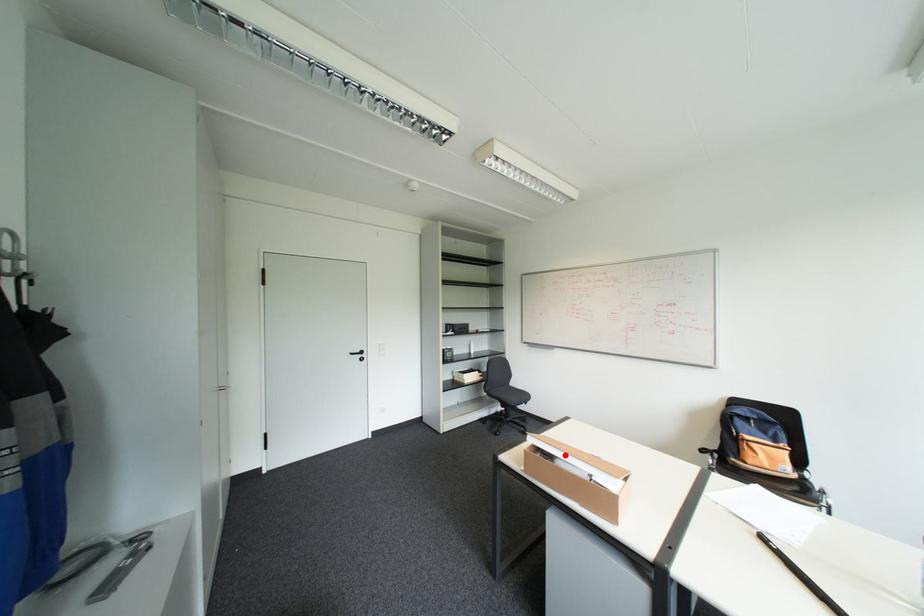
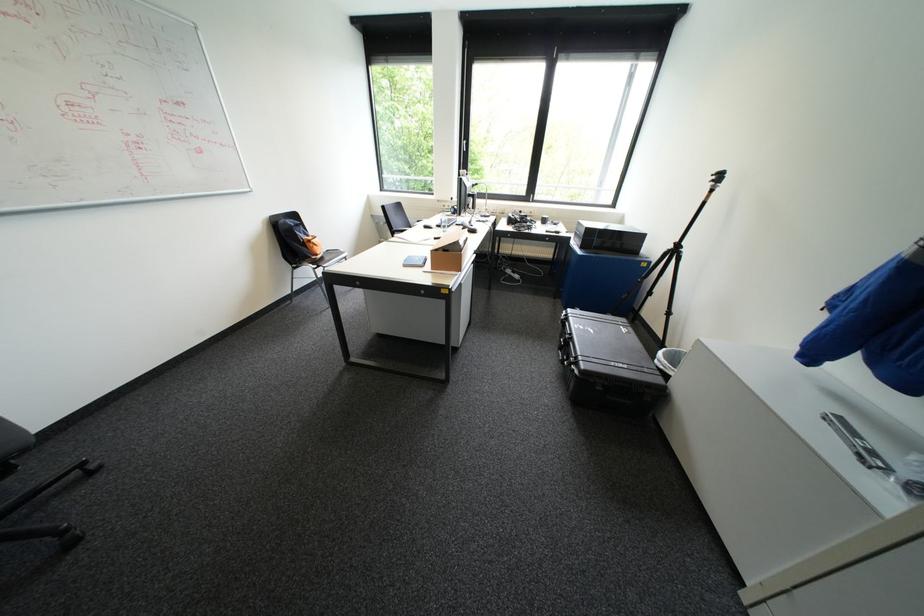
Question: I am providing you with two images of the same scene from different viewpoints. A red point is marked on the first image. Can you still see the location of the red point in image 2?

Choices:
 (A) Yes
 (B) No

Answer: (B)